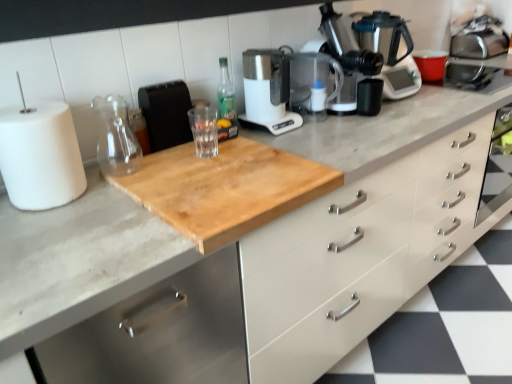
Identify the location of free space in front of transparent plastic blender at center, the second appliance when ordered from left to right. This screenshot has height=384, width=512. (325, 129).